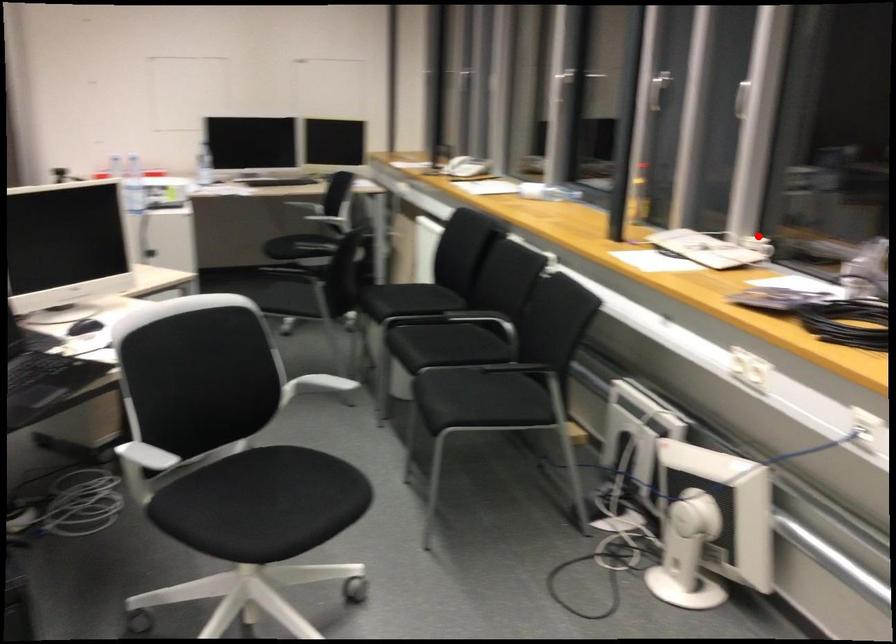
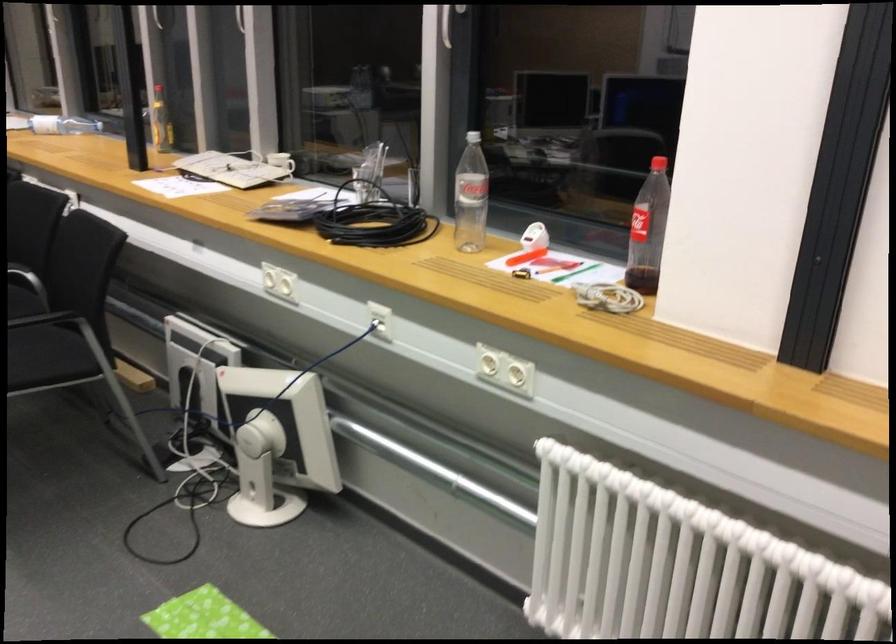
Locate, in the second image, the point that corresponds to the highlighted location in the first image.

(280, 162)